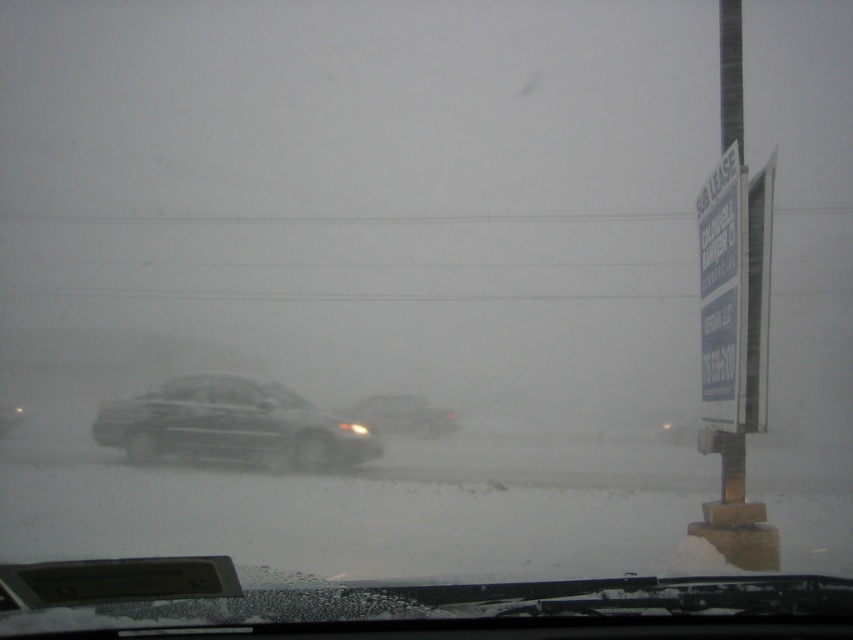
Question: Does sleek metallic sedan at center appear over white paper sign at right?

Choices:
 (A) yes
 (B) no

Answer: (B)

Question: Does sleek metallic sedan at center appear on the left side of matte black car at center?

Choices:
 (A) yes
 (B) no

Answer: (A)

Question: Among these objects, which one is farthest from the camera?

Choices:
 (A) sleek metallic sedan at center
 (B) white paper sign at right

Answer: (A)

Question: Which point is farther from the camera taking this photo?

Choices:
 (A) (225, 420)
 (B) (709, 252)
 (C) (350, 413)

Answer: (C)

Question: Can you confirm if sleek metallic sedan at center is wider than white paper sign at right?

Choices:
 (A) yes
 (B) no

Answer: (A)

Question: Considering the real-world distances, which object is farthest from the white paper sign at right?

Choices:
 (A) sleek metallic sedan at center
 (B) matte black car at center

Answer: (B)